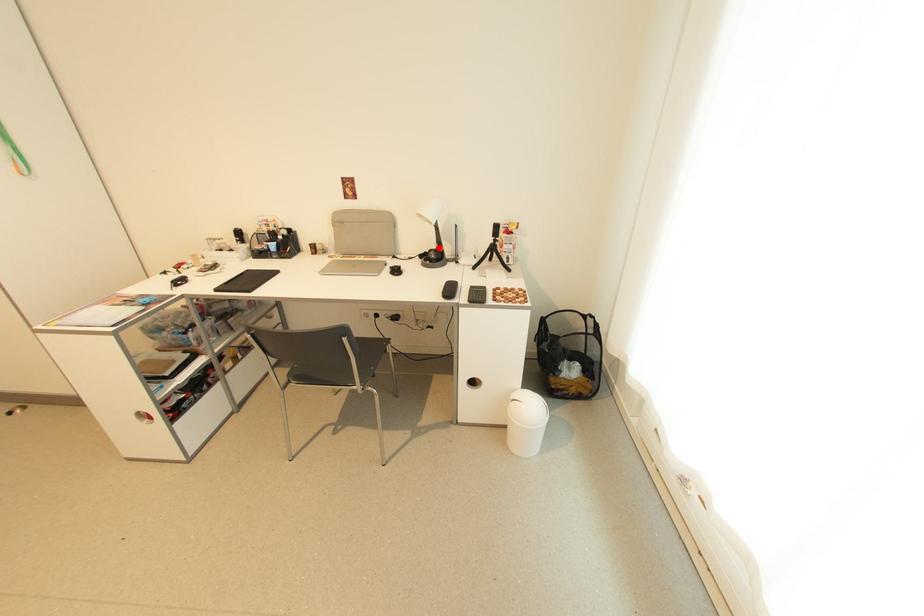
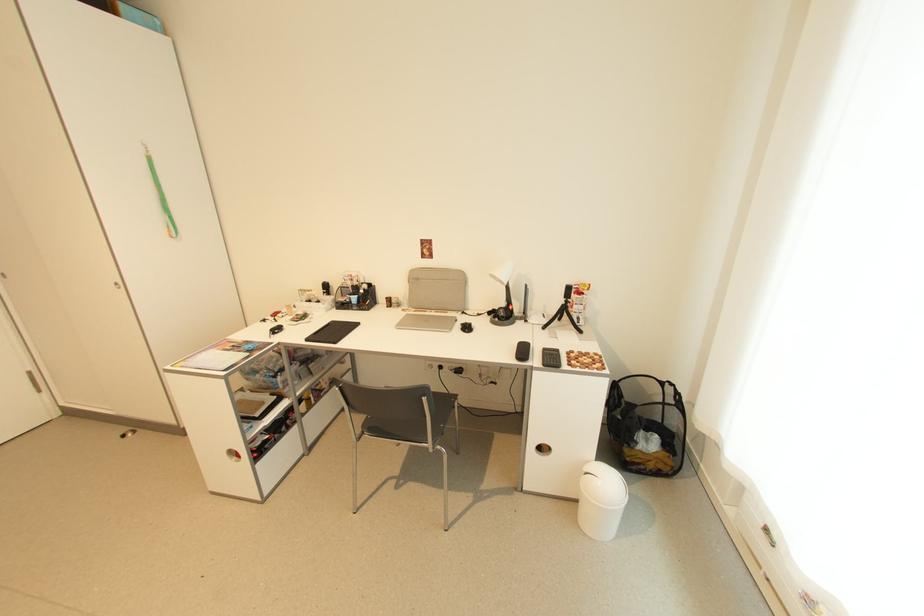
The point at the highlighted location is marked in the first image. Where is the corresponding point in the second image?

(507, 306)